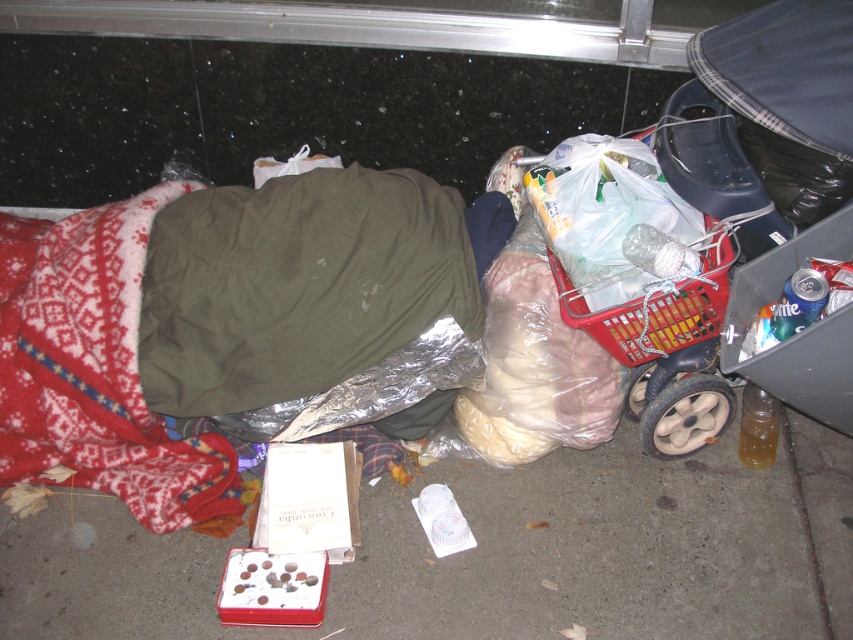
You are a delivery person who needs to place a small package on the smooth concrete pavement at lower center. However, there is an olive green fabric sleeping bag at center nearby. Can you place the package there without disturbing the sleeping bag?

The smooth concrete pavement at lower center and olive green fabric sleeping bag at center are 19.46 inches apart. Since the package is small, you can place it on the smooth concrete pavement at lower center as long as it stays at least 19.46 inches away from the olive green fabric sleeping bag at center to avoid disturbing it.

You are a social worker assessing the living situation of the individual in the image. You need to determine the spatial arrangement of their belongings to understand their living conditions better. Based on the scene, is the olive green fabric sleeping bag at center located to the right or left of the red fleece blanket at lower left?

The olive green fabric sleeping bag at center is to the right of the red fleece blanket at lower left.

You are a delivery person who needs to place a package near the olive green fabric sleeping bag at center and the red fleece blanket at lower left. Based on their positions, where should you place the package so it doesn not obstruct either item?

The olive green fabric sleeping bag at center is above the red fleece blanket at lower left. To avoid obstructing either item, place the package below the red fleece blanket at lower left or to the side of both items where there is more space.